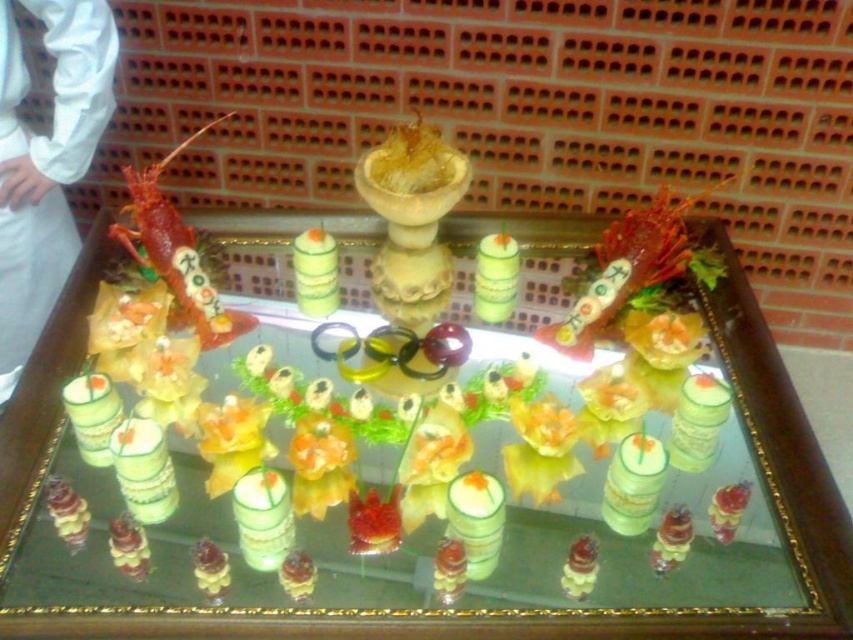
You are standing at the point marked as point (x=86, y=436) and want to reach the entrance of the room, which is 2 meters away from your current position. Can you safely walk straight to the entrance without any obstacles?

The distance between point (x=86, y=436) and the viewer is 1.03 meters, so the entrance is 2 meters away from your current position. Since the path isn t mentioned to have any obstacles, you can safely walk straight to the entrance.

You are observing the platter and want to place a new garnish between the two points, point (366, 600) and point (192, 244). Which point should you place it closer to if you want the garnish to appear larger in the image?

You should place the garnish closer to point (366, 600) because it is closer to the viewer, making the garnish appear larger in the image.

You are a guest at a dinner party and see the white fabric at left and the shiny red lobster at upper left on the platter. Which object is positioned further to the left?

The white fabric at left is positioned further to the left than the shiny red lobster at upper left.